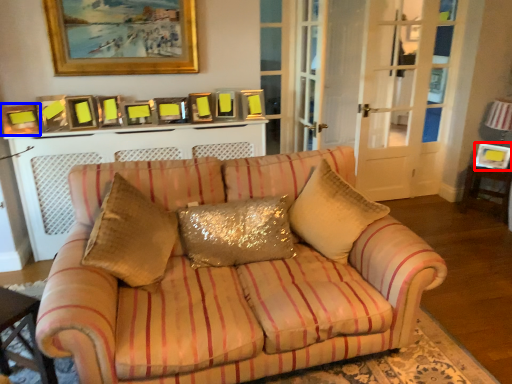
Question: Among these objects, which one is nearest to the camera, picture frame (highlighted by a red box) or picture frame (highlighted by a blue box)?

Choices:
 (A) picture frame
 (B) picture frame

Answer: (B)